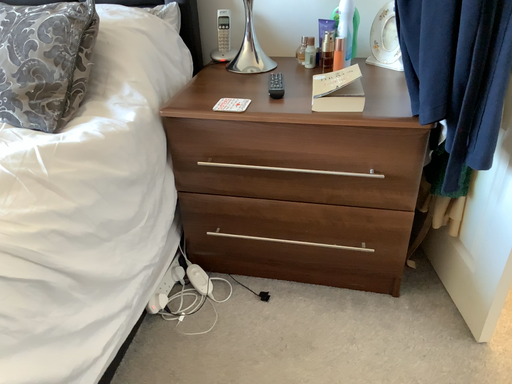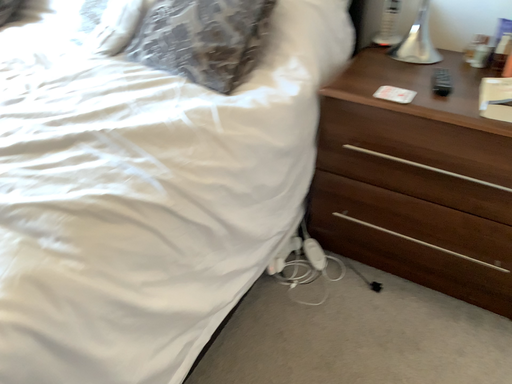
Question: Which way did the camera rotate in the video?

Choices:
 (A) rotated right
 (B) rotated left

Answer: (B)